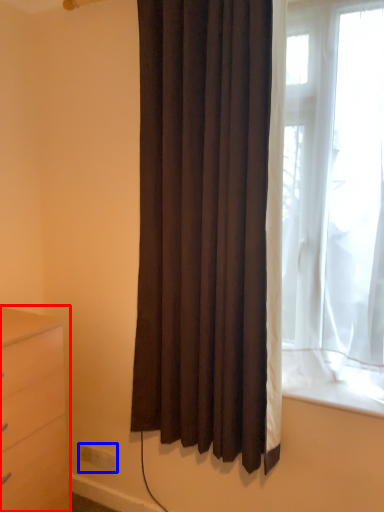
Question: Which of the following is the farthest to the observer, chest of drawers (highlighted by a red box) or electric outlet (highlighted by a blue box)?

Choices:
 (A) chest of drawers
 (B) electric outlet

Answer: (B)